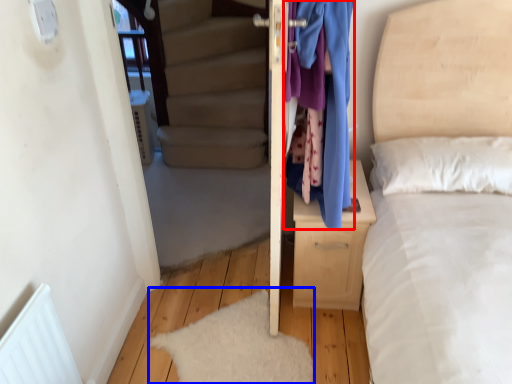
Question: Among these objects, which one is nearest to the camera, clothing (highlighted by a red box) or mat (highlighted by a blue box)?

Choices:
 (A) clothing
 (B) mat

Answer: (A)